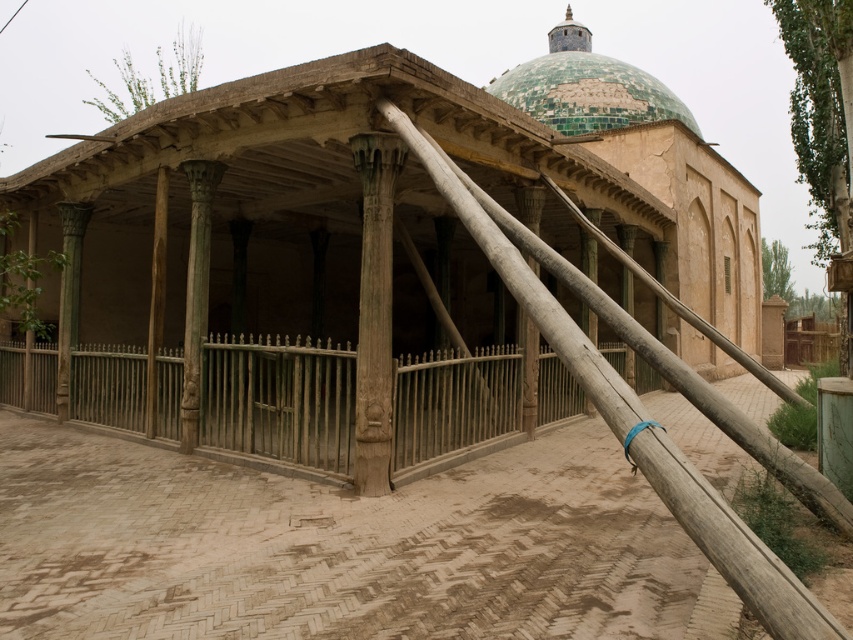
Is point (677, 330) positioned behind point (555, 116)?

No, (677, 330) is closer to viewer.

The width and height of the screenshot is (853, 640). Describe the element at coordinates (368, 202) in the screenshot. I see `wooden hut at center` at that location.

Who is more distant from viewer, (561, 122) or (537, 100)?

Positioned behind is point (537, 100).

Where is `wooden hut at center`? The height and width of the screenshot is (640, 853). wooden hut at center is located at coordinates pyautogui.click(x=368, y=202).

Describe the element at coordinates (279, 401) in the screenshot. I see `wooden fence at center` at that location.

Who is positioned more to the right, wooden fence at center or greenish-brown wood column at center?

greenish-brown wood column at center is more to the right.

Is point (311, 380) farther from viewer compared to point (363, 301)?

Yes, point (311, 380) is farther from viewer.

The height and width of the screenshot is (640, 853). In order to click on wooden fence at center in this screenshot , I will do `click(279, 401)`.

Between greenish-brown wood column at center and green tiled dome at upper center, which one is positioned lower?

greenish-brown wood column at center is lower down.

Is point (357, 472) positioned in front of point (561, 108)?

Yes, it is in front of point (561, 108).

The image size is (853, 640). I want to click on greenish-brown wood column at center, so (x=374, y=308).

The height and width of the screenshot is (640, 853). I want to click on greenish-brown wood column at center, so click(x=374, y=308).